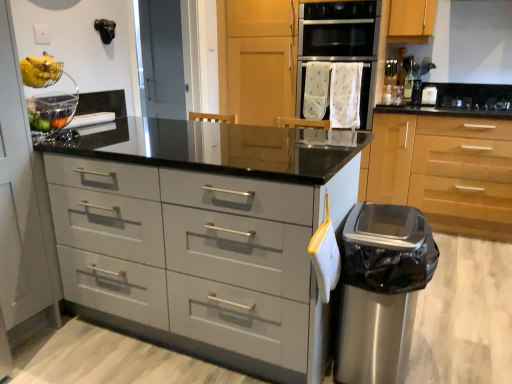
Question: From the image's perspective, is stainless steel trash can at lower right under white fabric oven at center?

Choices:
 (A) yes
 (B) no

Answer: (A)

Question: From a real-world perspective, does stainless steel trash can at lower right stand above white fabric oven at center?

Choices:
 (A) no
 (B) yes

Answer: (A)

Question: Is stainless steel trash can at lower right facing towards white fabric oven at center?

Choices:
 (A) no
 (B) yes

Answer: (A)

Question: Is the depth of stainless steel trash can at lower right greater than that of white fabric oven at center?

Choices:
 (A) yes
 (B) no

Answer: (B)

Question: Would you consider stainless steel trash can at lower right to be distant from white fabric oven at center?

Choices:
 (A) no
 (B) yes

Answer: (B)

Question: Is stainless steel trash can at lower right bigger than white fabric oven at center?

Choices:
 (A) yes
 (B) no

Answer: (A)

Question: Is yellow matte bananas at upper left positioned far away from matte gray drawers at center?

Choices:
 (A) yes
 (B) no

Answer: (B)

Question: Does yellow matte bananas at upper left come behind matte gray drawers at center?

Choices:
 (A) yes
 (B) no

Answer: (A)

Question: Considering the relative sizes of yellow matte bananas at upper left and matte gray drawers at center in the image provided, is yellow matte bananas at upper left wider than matte gray drawers at center?

Choices:
 (A) no
 (B) yes

Answer: (A)

Question: Does yellow matte bananas at upper left have a lesser height compared to matte gray drawers at center?

Choices:
 (A) yes
 (B) no

Answer: (A)

Question: Can you confirm if yellow matte bananas at upper left is thinner than matte gray drawers at center?

Choices:
 (A) no
 (B) yes

Answer: (B)

Question: Is matte gray drawers at center inside yellow matte bananas at upper left?

Choices:
 (A) no
 (B) yes

Answer: (A)

Question: Can you confirm if black glass gas stove at upper right is wider than matte gray drawers at center?

Choices:
 (A) yes
 (B) no

Answer: (B)